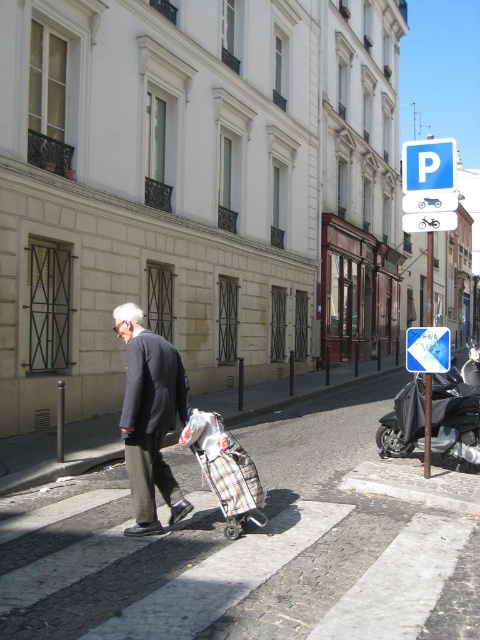
Question: Which of the following is the farthest from the observer?

Choices:
 (A) (372, 557)
 (B) (240, 474)
 (C) (132, 456)

Answer: (C)

Question: Is white paved crosswalk at center to the right of plaid fabric suitcase at center from the viewer's perspective?

Choices:
 (A) yes
 (B) no

Answer: (A)

Question: Is blue plastic parking sign at upper right above blue plastic arrow at upper right?

Choices:
 (A) yes
 (B) no

Answer: (A)

Question: Among these points, which one is farthest from the camera?

Choices:
 (A) (386, 454)
 (B) (409, 148)
 (C) (144, 417)

Answer: (A)

Question: Based on their relative distances, which object is farther from the black matte motorcycle at lower right?

Choices:
 (A) blue plastic arrow at upper right
 (B) blue plastic parking sign at upper right

Answer: (B)

Question: Does white paved crosswalk at center appear over black matte motorcycle at lower right?

Choices:
 (A) yes
 (B) no

Answer: (B)